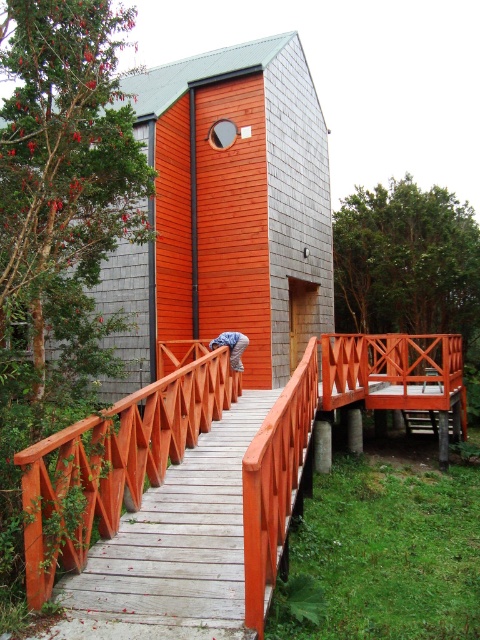
Question: Which of the following is the farthest from the observer?

Choices:
 (A) matte orange wooden rail at center
 (B) wooden bridge at center

Answer: (A)

Question: Which object is closer to the camera taking this photo?

Choices:
 (A) matte orange wooden rail at center
 (B) wooden bridge at center

Answer: (B)

Question: Can you confirm if wooden bridge at center is positioned to the left of matte orange wooden rail at center?

Choices:
 (A) no
 (B) yes

Answer: (A)

Question: Is wooden bridge at center smaller than matte orange wooden rail at center?

Choices:
 (A) no
 (B) yes

Answer: (A)

Question: Which point is farther to the camera?

Choices:
 (A) (192, 420)
 (B) (275, 420)

Answer: (A)

Question: Is wooden bridge at center further to the viewer compared to matte orange wooden rail at center?

Choices:
 (A) no
 (B) yes

Answer: (A)